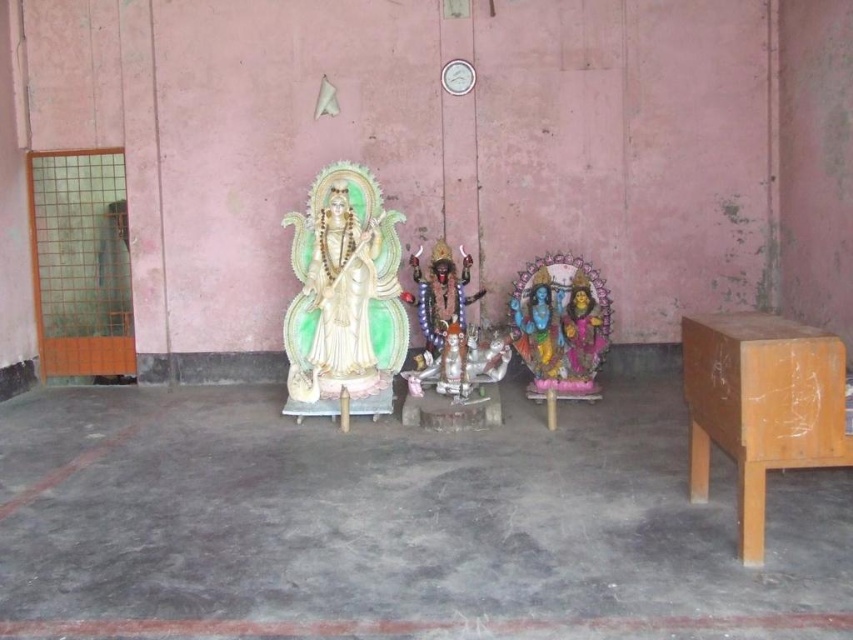
Which of these two, wooden table at right or ivory glossy statue at center, stands shorter?

wooden table at right

Who is more forward, (x=775, y=444) or (x=299, y=291)?

Point (x=775, y=444)

At what (x,y) coordinates should I click in order to perform the action: click on wooden table at right. Please return your answer as a coordinate pair (x, y). The image size is (853, 640). Looking at the image, I should click on (761, 404).